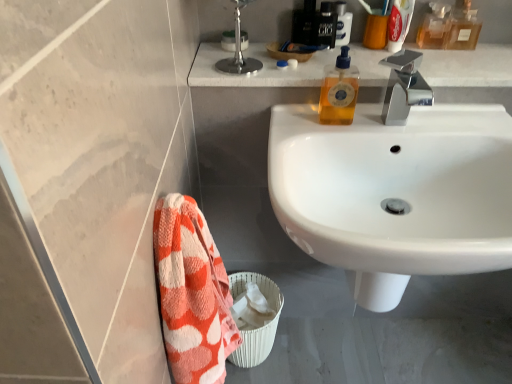
At what (x,y) coordinates should I click in order to perform the action: click on blank space to the left of translucent plastic mouthwash at upper center, marked as the 1th mouthwash in a left-to-right arrangement. Please return your answer as a coordinate pair (x, y). Looking at the image, I should click on (306, 48).